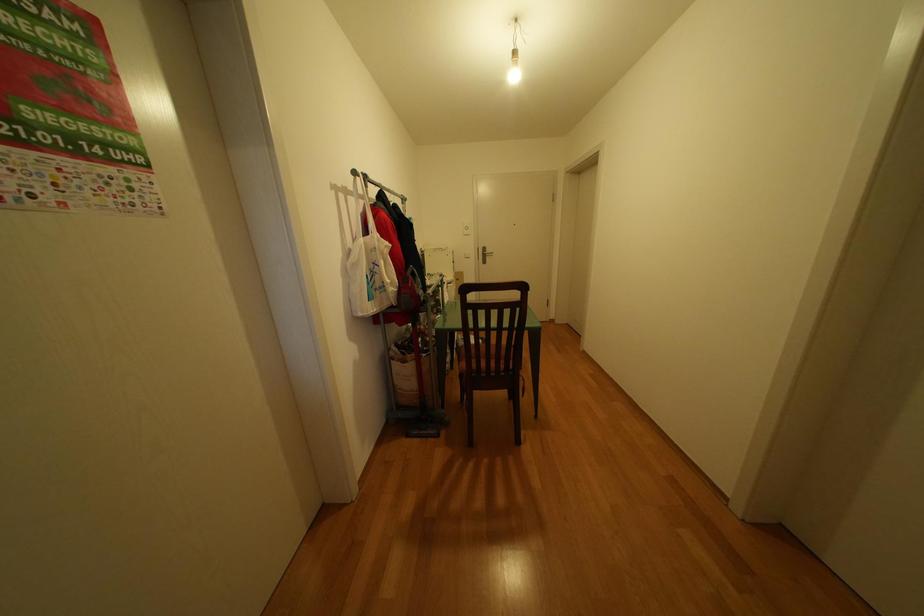
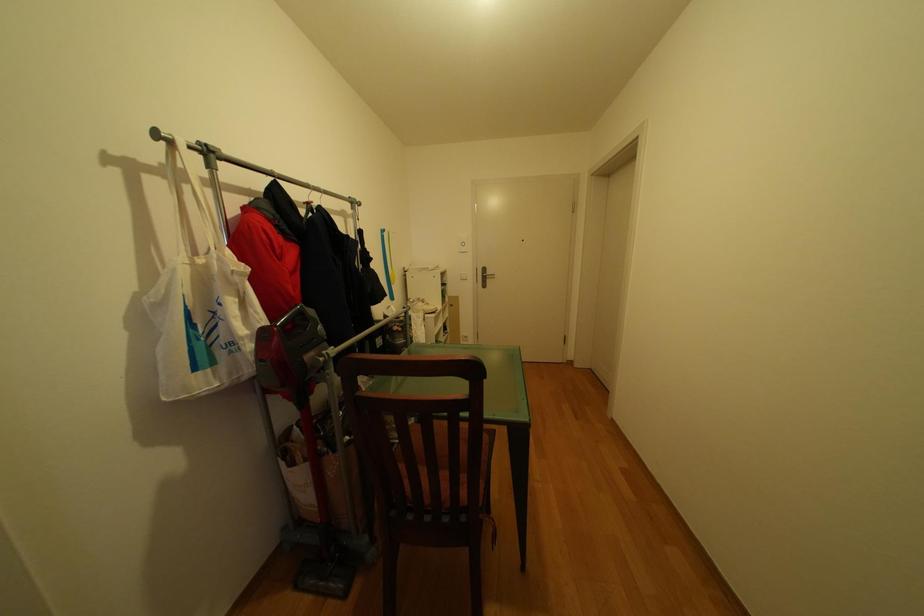
What movement of the cameraman would produce the second image?

The cameraman moved toward right, forward.